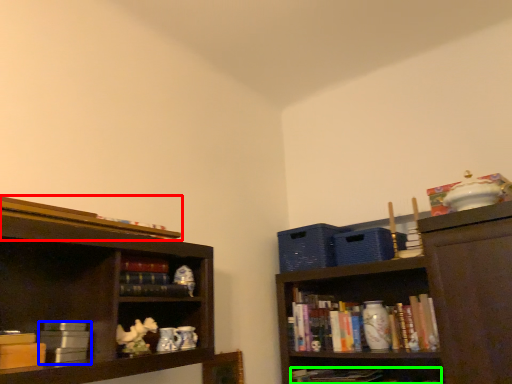
Question: Which object is positioned farthest from book (highlighted by a red box)? Select from book (highlighted by a blue box) and book (highlighted by a green box).

Choices:
 (A) book
 (B) book

Answer: (B)